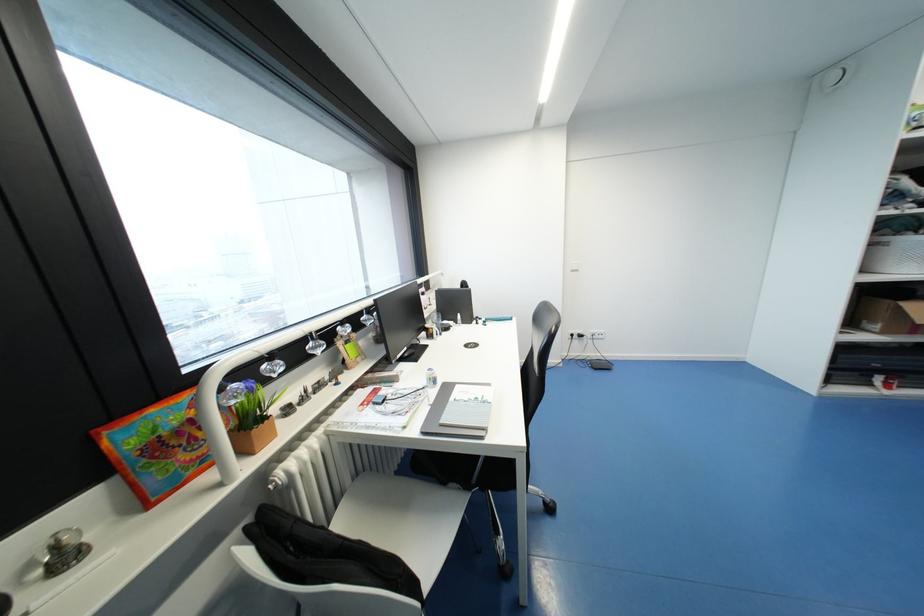
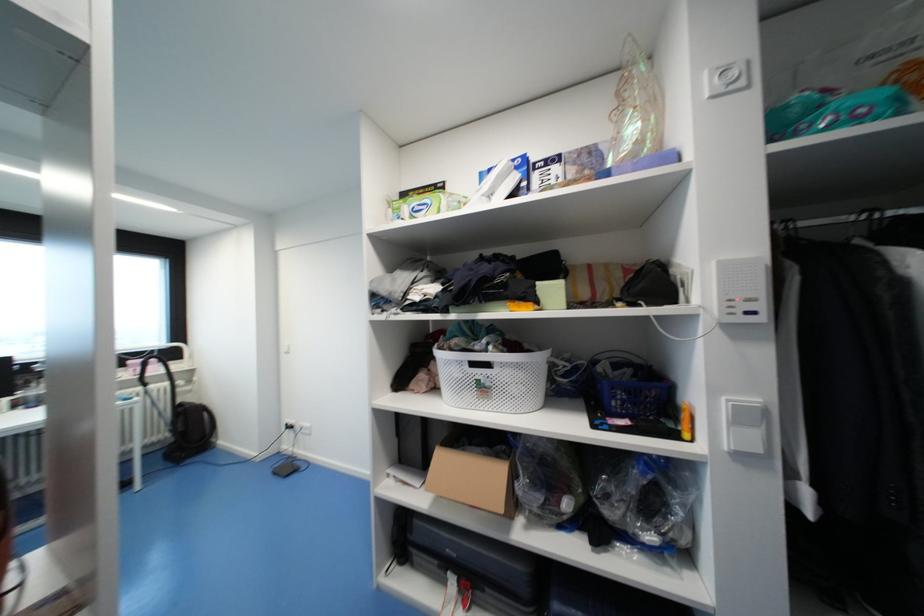
Question: Which direction would the cameraman need to move to produce the second image? Reply with the corresponding letter.

Choices:
 (A) Left
 (B) Right
 (C) Forward
 (D) Backward

Answer: (B)